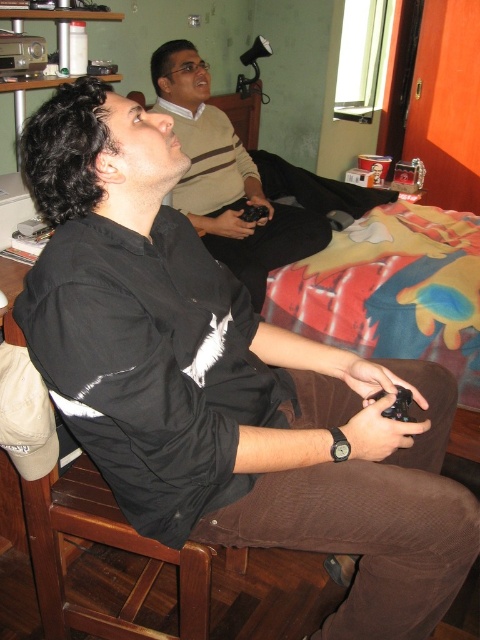
Is black matte shirt at upper left above black matte game controller at lower center?

Correct, black matte shirt at upper left is located above black matte game controller at lower center.

Can you confirm if black matte shirt at upper left is positioned to the right of black matte game controller at lower center?

In fact, black matte shirt at upper left is to the left of black matte game controller at lower center.

Describe the element at coordinates (227, 179) in the screenshot. This screenshot has height=640, width=480. I see `black matte shirt at upper left` at that location.

Where is `black matte shirt at upper left`? black matte shirt at upper left is located at coordinates (227, 179).